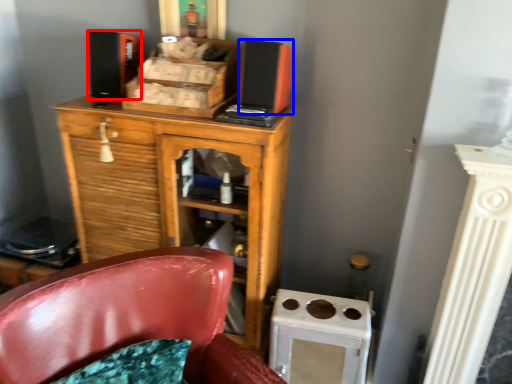
Question: Which of the following is the closest to the observer, speaker (highlighted by a red box) or speaker (highlighted by a blue box)?

Choices:
 (A) speaker
 (B) speaker

Answer: (B)